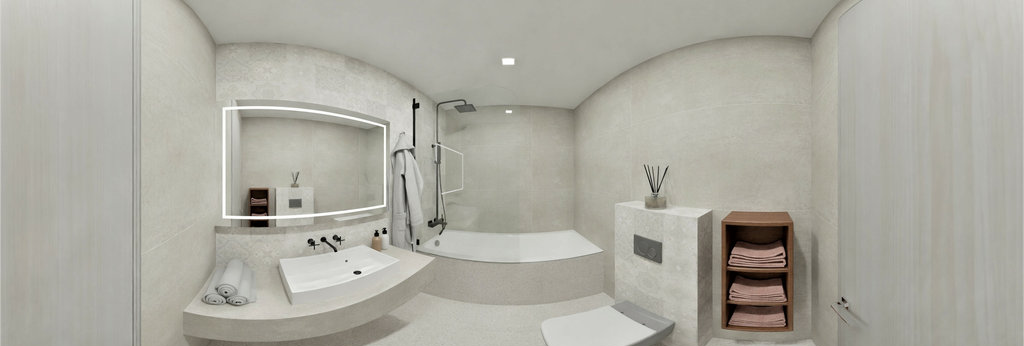
Identify the location of towels. (760, 257), (760, 283), (760, 314), (226, 289).